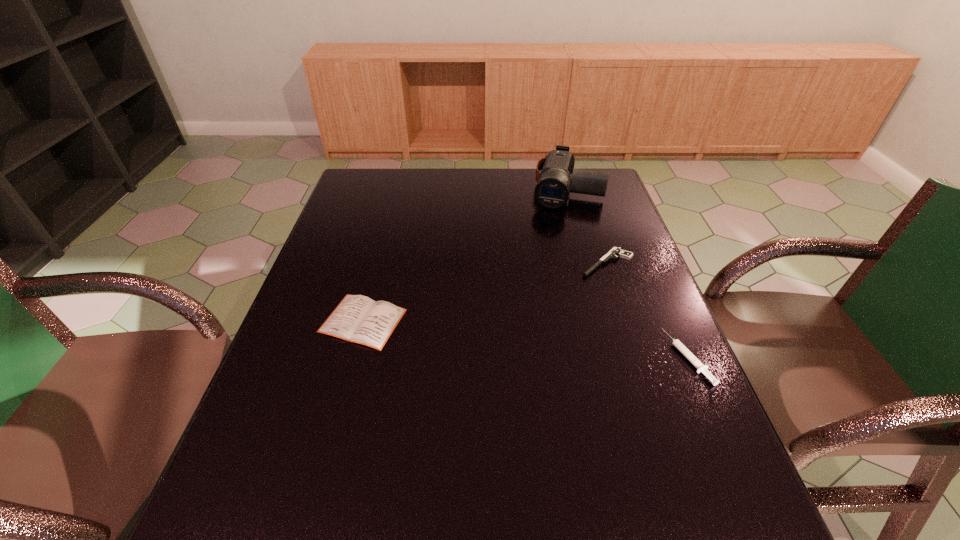
Where is `the leftmost object`? Image resolution: width=960 pixels, height=540 pixels. the leftmost object is located at coordinates (359, 319).

The height and width of the screenshot is (540, 960). I want to click on syringe, so click(701, 368).

Where is `camcorder`? camcorder is located at coordinates (552, 191).

Image resolution: width=960 pixels, height=540 pixels. In order to click on the farthest object in this screenshot , I will do [552, 191].

Image resolution: width=960 pixels, height=540 pixels. Identify the location of pistol. (616, 251).

At what (x,y) coordinates should I click in order to perform the action: click on the third nearest object. Please return your answer as a coordinate pair (x, y). The image size is (960, 540). Looking at the image, I should click on click(616, 251).

This screenshot has width=960, height=540. In order to click on vacant space located on the right of the leftmost object in this screenshot , I will do `click(463, 321)`.

The height and width of the screenshot is (540, 960). What are the coordinates of `blank area located 0.280m on the left of the syringe` in the screenshot? It's located at (545, 357).

At what (x,y) coordinates should I click in order to perform the action: click on free space located on the lens of the tallest object. Please return your answer as a coordinate pair (x, y). The image size is (960, 540). Looking at the image, I should click on (544, 272).

This screenshot has height=540, width=960. Find the location of `vacant region located 0.130m on the lens of the tallest object`. vacant region located 0.130m on the lens of the tallest object is located at coordinates (555, 234).